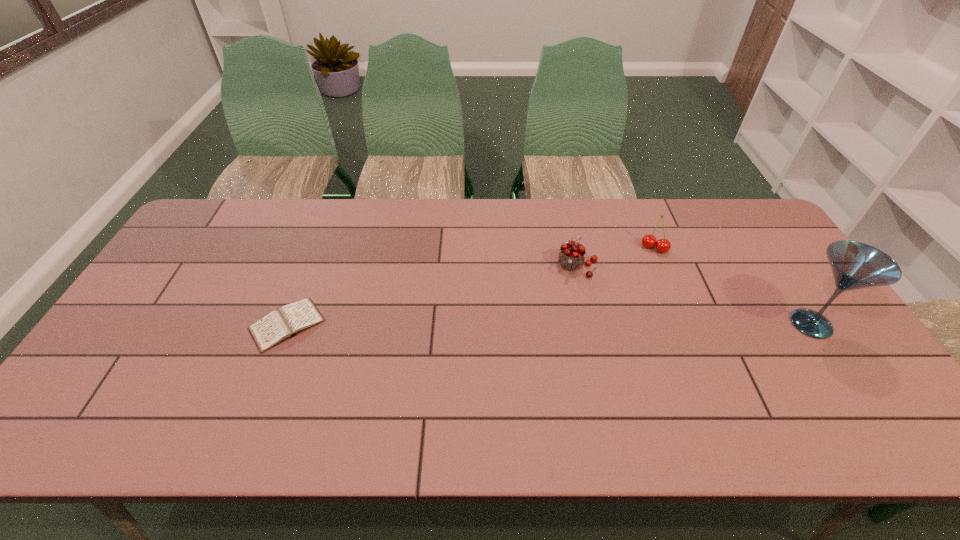
Where is `free space on the desktop that is between the shortest object and the martini and is positioned with the stems of the right pot filled with cherries pointing upwards`? free space on the desktop that is between the shortest object and the martini and is positioned with the stems of the right pot filled with cherries pointing upwards is located at coordinates (622, 324).

What are the coordinates of `free space on the desktop that is between the shortest object and the martini and is positioned on the handle side of the third object from right to left` in the screenshot? It's located at (563, 325).